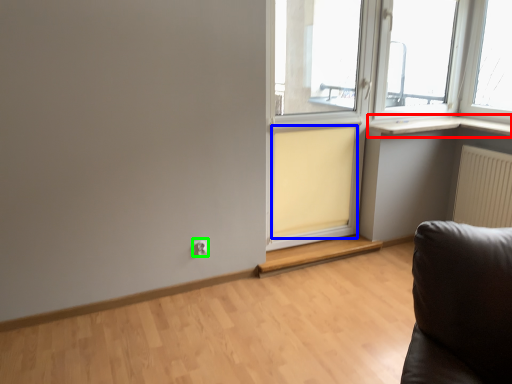
Question: Which object is the closest to the window sill (highlighted by a red box)? Choose among these: curtain (highlighted by a blue box) or electric outlet (highlighted by a green box).

Choices:
 (A) curtain
 (B) electric outlet

Answer: (A)